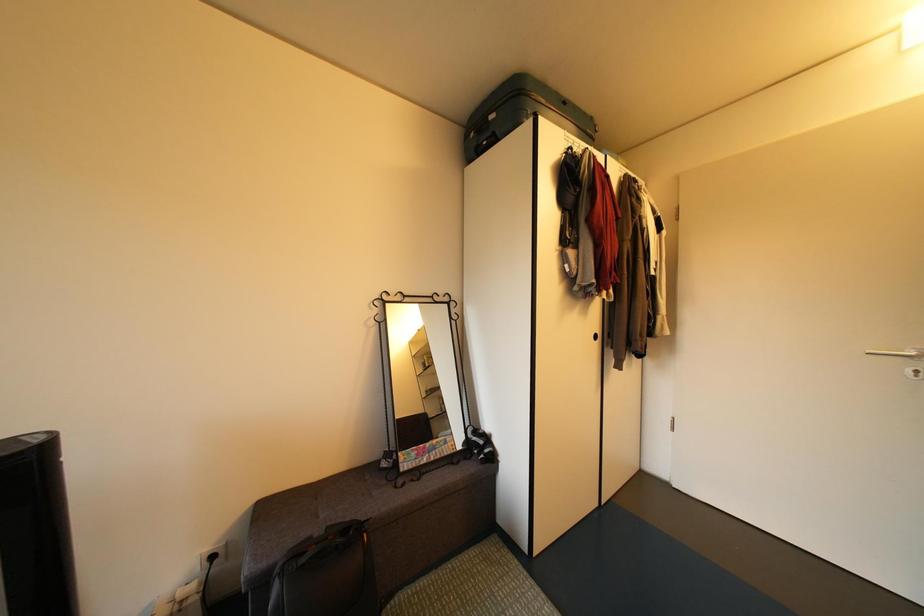
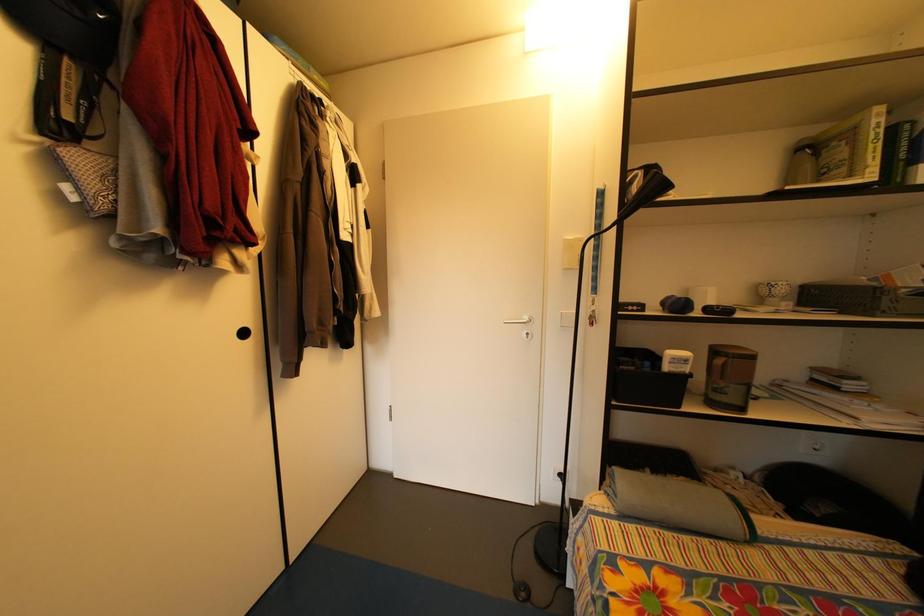
Question: The camera is either moving clockwise (left) or counter-clockwise (right) around the object. The first image is from the beginning of the video and the second image is from the end. Is the camera moving left or right when shooting the video?

Choices:
 (A) Left
 (B) Right

Answer: (A)